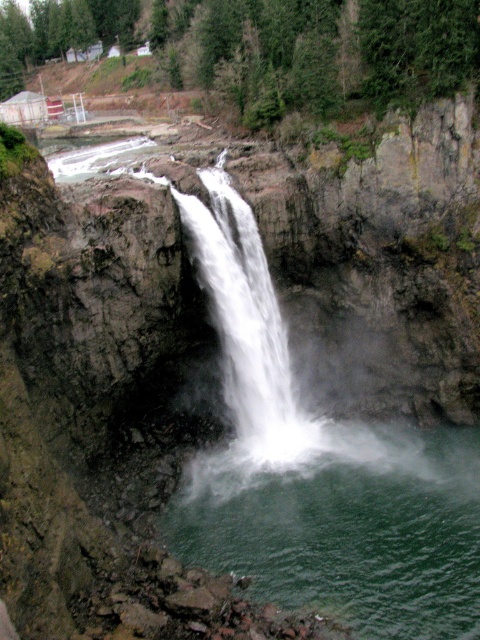
You are a hiker who wants to cross the pool of green liquid at center to reach the white frothy water at center. The rope bridge you have can only span up to 15 feet. Is the bridge long enough?

The distance between the green liquid at center and white frothy water at center is 18.67 feet, which is longer than the 15 feet capacity of the rope bridge. Therefore, the bridge is not long enough to span the gap between the green liquid at center and white frothy water at center.